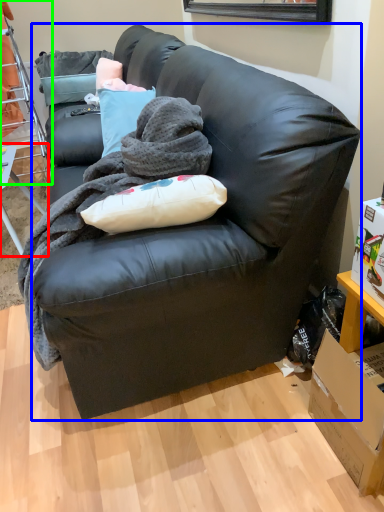
Question: Based on their relative distances, which object is nearer to table (highlighted by a red box)? Choose from studio couch (highlighted by a blue box) and bunk bed (highlighted by a green box).

Choices:
 (A) studio couch
 (B) bunk bed

Answer: (B)